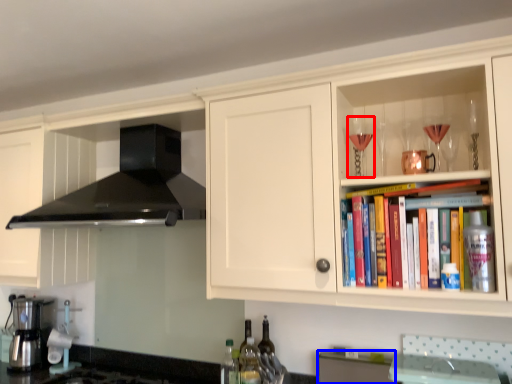
Question: Which object appears farthest to the camera in this image, wine glass (highlighted by a red box) or cabinetry (highlighted by a blue box)?

Choices:
 (A) wine glass
 (B) cabinetry

Answer: (B)